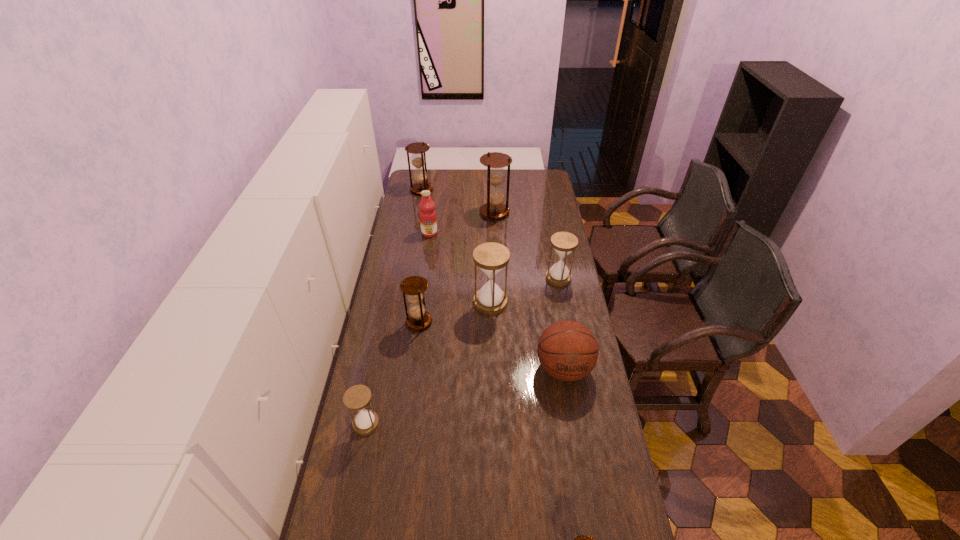
Identify the location of free space located on the back of the fifth nearest hourglass. (549, 229).

I want to click on free space located on the side with brand label of the seventh farthest object, so click(584, 490).

Find the location of a particular element. This screenshot has width=960, height=540. vacant area situated on the back of the second nearest hourglass is located at coordinates pyautogui.click(x=383, y=339).

Locate an element on the screen. The height and width of the screenshot is (540, 960). object that is at the far edge is located at coordinates (418, 158).

The height and width of the screenshot is (540, 960). In order to click on fruit juice located in the left edge section of the desktop in this screenshot , I will do `click(428, 222)`.

This screenshot has height=540, width=960. Identify the location of hourglass at the right edge. (564, 243).

The width and height of the screenshot is (960, 540). I want to click on basketball that is positioned at the right edge, so click(x=567, y=350).

Where is `object at the far left corner`? The height and width of the screenshot is (540, 960). object at the far left corner is located at coordinates (418, 158).

The width and height of the screenshot is (960, 540). What are the coordinates of `vacant area at the far edge` in the screenshot? It's located at (444, 178).

Where is `vacant space at the left edge`? The image size is (960, 540). vacant space at the left edge is located at coordinates (395, 356).